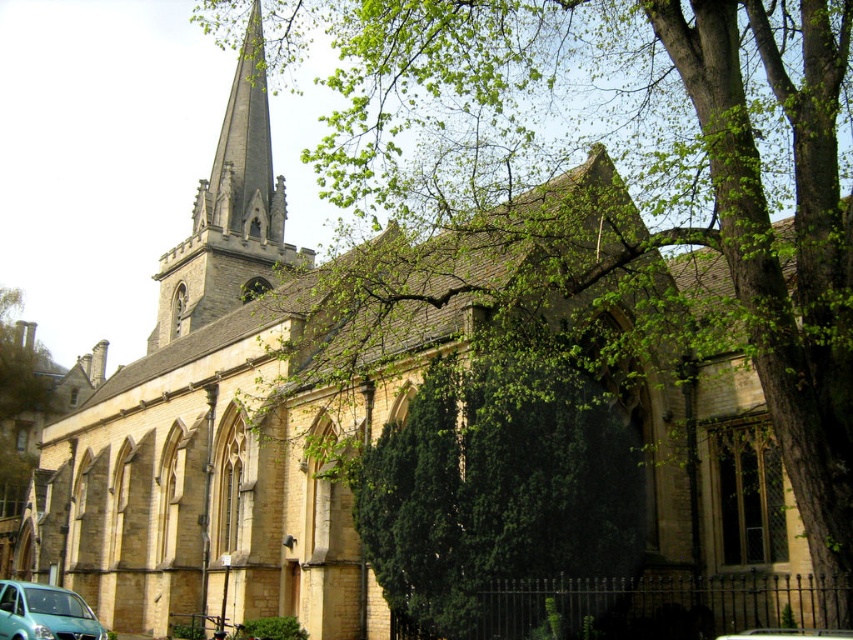
You are a tour guide standing in front of the historic stone church. You notice the dark gray stone steeple at upper left and the teal matte van at lower left. A tourist asks you if they can see both objects from where they are standing. What do you tell them?

Both the dark gray stone steeple at upper left and the teal matte van at lower left are visible from your current position since they are 72.17 meters apart, which is within a typical viewing distance.

You are standing in front of the historic stone church and want to locate the dark gray stone steeple at upper left. According to the coordinates provided, where exactly is it positioned?

The dark gray stone steeple at upper left is located at point [230,212].

You are standing outside the historic stone church and want to take a photo of the dark gray stone steeple at upper left. If your camera can focus on objects up to 80 meters away, will you be able to capture a clear image of the steeple?

The dark gray stone steeple at upper left is 79.97 meters away from the viewer. Since the camera can focus up to 80 meters, the steeple is within range, so a clear image can be captured.